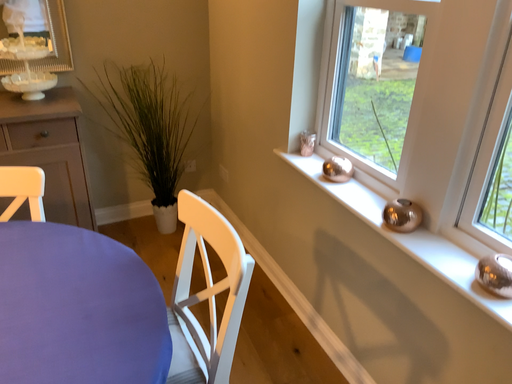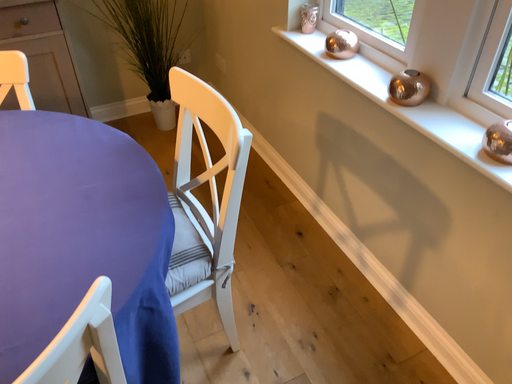
Question: How did the camera likely rotate when shooting the video?

Choices:
 (A) rotated downward
 (B) rotated upward

Answer: (A)